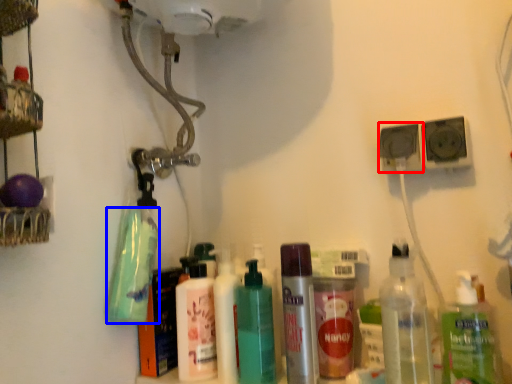
Question: Which object is further to the camera taking this photo, speaker (highlighted by a red box) or cleaning product (highlighted by a blue box)?

Choices:
 (A) speaker
 (B) cleaning product

Answer: (A)